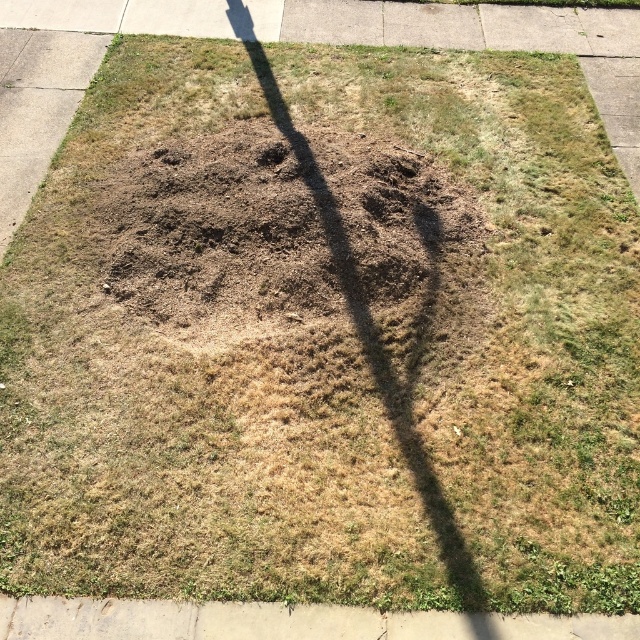
From the picture: You are standing at the center of the disturbed grass patch and want to walk to the gray concrete curb at lower left. According to the coordinates provided, in which direction should you walk?

The gray concrete curb at lower left is located at coordinates point (282,621). Since you are at the center of the disturbed grass patch, you should walk towards the lower left direction to reach the gray concrete curb at lower left.